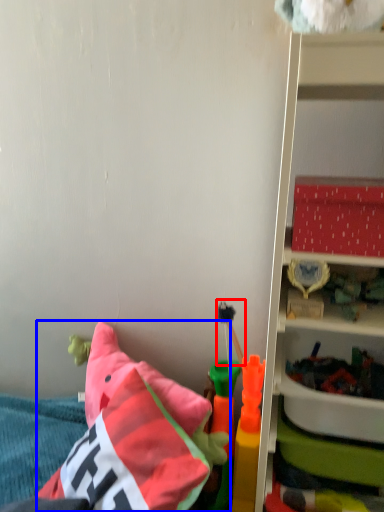
Question: Which object appears farthest to the camera in this image, toy (highlighted by a red box) or pillow (highlighted by a blue box)?

Choices:
 (A) toy
 (B) pillow

Answer: (A)